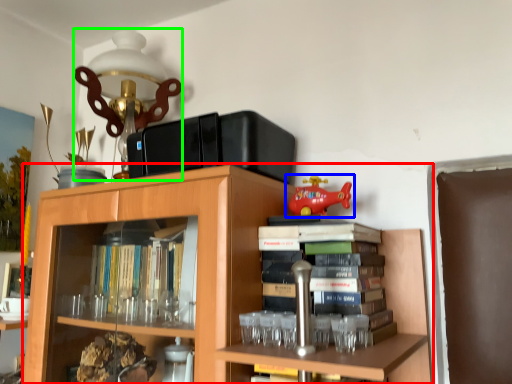
Question: Which is farther away from bookcase (highlighted by a red box)? toy (highlighted by a blue box) or table lamp (highlighted by a green box)?

Choices:
 (A) toy
 (B) table lamp

Answer: (B)